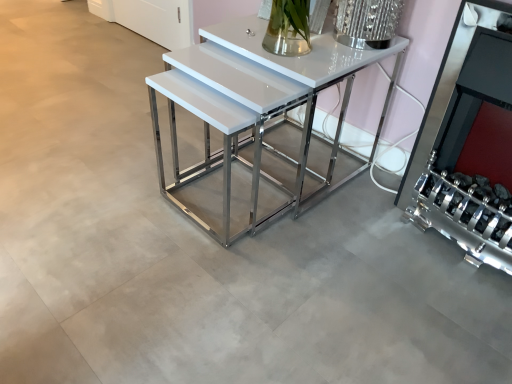
Locate an element on the screen. empty space that is in between white glossy table at center and silver metallic fireplace at right is located at coordinates (362, 231).